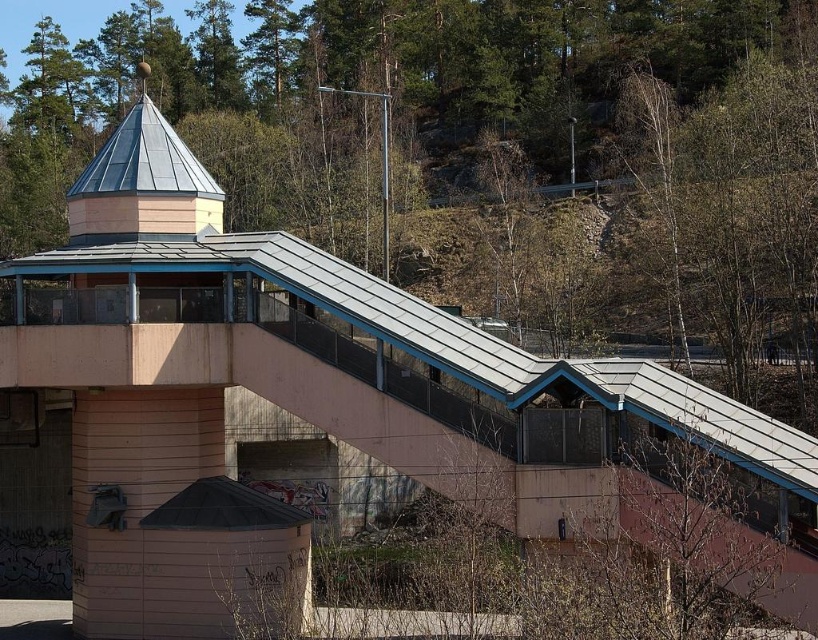
You are standing on the bridge and looking towards the green leafy tree at center and the metallic silver spire at upper center. Which object is closer to you?

The green leafy tree at center is closer to you because the metallic silver spire at upper center is behind it.

You are standing on the bridge and looking towards the landscape. You see a green leafy tree at center and a metallic silver spire at upper center. Which object is located to the right of the other?

The green leafy tree at center is positioned on the right side of metallic silver spire at upper center.

Please look at the image and locate the point at coordinates (488, 147). What object is situated at this exact point?

The green leafy tree at center is located at point (488, 147).